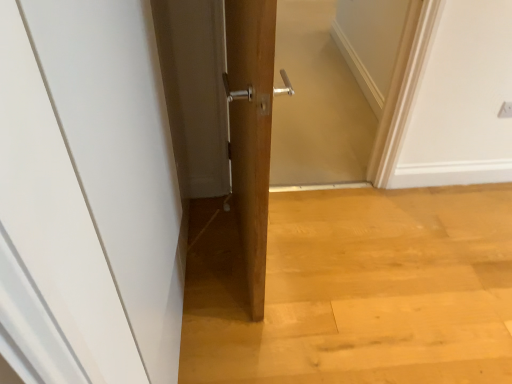
Question: From the image's perspective, is white matte door at center above or below white plastic electric outlet at upper right?

Choices:
 (A) below
 (B) above

Answer: (A)

Question: Is white matte door at center inside or outside of white plastic electric outlet at upper right?

Choices:
 (A) outside
 (B) inside

Answer: (A)

Question: Which of these objects is positioned farthest from the wooden screen door at center?

Choices:
 (A) white plastic electric outlet at upper right
 (B) white matte door at center

Answer: (B)

Question: Estimate the real-world distances between objects in this image. Which object is closer to the white plastic electric outlet at upper right?

Choices:
 (A) white matte door at center
 (B) wooden screen door at center

Answer: (B)